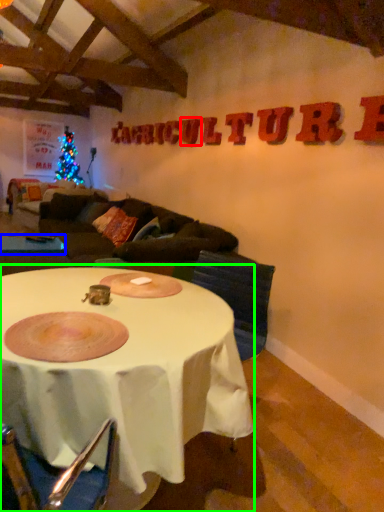
Question: Based on their relative distances, which object is nearer to letter (highlighted by a red box)? Choose from table (highlighted by a blue box) and table (highlighted by a green box).

Choices:
 (A) table
 (B) table

Answer: (A)